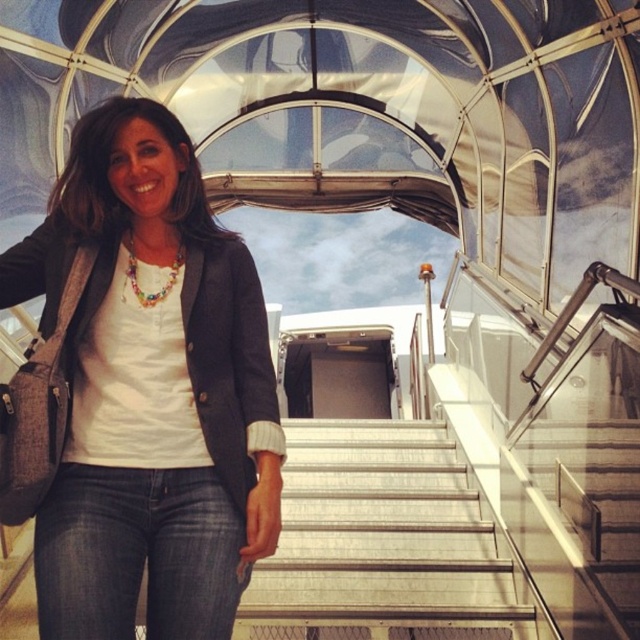
Can you confirm if denim jeans at center is thinner than metallic silver stairs at center?

Yes.

Can you confirm if denim jeans at center is smaller than metallic silver stairs at center?

Incorrect, denim jeans at center is not smaller in size than metallic silver stairs at center.

The image size is (640, 640). What do you see at coordinates (140, 392) in the screenshot?
I see `denim jeans at center` at bounding box center [140, 392].

Where is `denim jeans at center`? denim jeans at center is located at coordinates (140, 392).

Does metallic silver stairs at center lie in front of dark blue denim jeans at lower center?

No, metallic silver stairs at center is further to the viewer.

Does point (337, 634) come farther from viewer compared to point (182, 520)?

That is True.

Is point (385, 614) positioned after point (177, 529)?

Yes.

Identify the location of metallic silver stairs at center. pyautogui.click(x=381, y=541).

Does denim jeans at center have a greater height compared to dark blue denim jeans at lower center?

Yes.

Where is `denim jeans at center`? This screenshot has height=640, width=640. denim jeans at center is located at coordinates (140, 392).